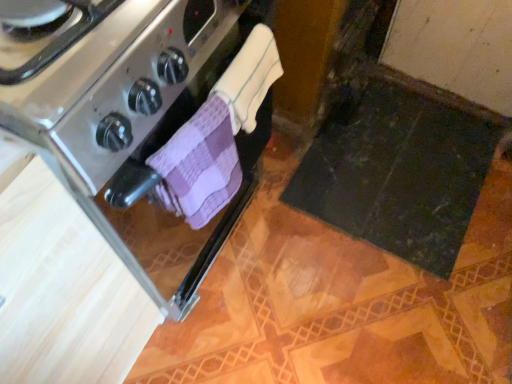
Question: Is stainless steel oven at left in front of or behind white terry cloth towel at center, the 2th bath towel from the bottom, in the image?

Choices:
 (A) front
 (B) behind

Answer: (A)

Question: In terms of width, does stainless steel oven at left look wider or thinner when compared to white terry cloth towel at center, the 2th bath towel from the bottom?

Choices:
 (A) thin
 (B) wide

Answer: (B)

Question: Which object is positioned farthest from the white terry cloth towel at center, which is counted as the 1th bath towel, starting from the top?

Choices:
 (A) purple checkered cloth at center, marked as the 1th bath towel in a bottom-to-top arrangement
 (B) stainless steel oven at left

Answer: (B)

Question: Estimate the real-world distances between objects in this image. Which object is farther from the stainless steel oven at left?

Choices:
 (A) white terry cloth towel at center, the 2th bath towel from the bottom
 (B) purple checkered cloth at center, marked as the 1th bath towel in a bottom-to-top arrangement

Answer: (A)